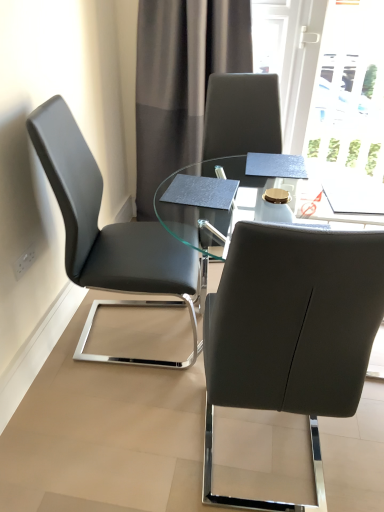
In order to face matte black chair at center, the first chair when ordered from right to left, should I rotate leftwards or rightwards?

Turn right approximately 11.751 degrees to face it.

This screenshot has width=384, height=512. What do you see at coordinates (224, 199) in the screenshot? I see `transparent glass table at center` at bounding box center [224, 199].

Identify the location of gray fabric curtain at upper center. The height and width of the screenshot is (512, 384). (181, 80).

From the picture: From a real-world perspective, is matte black chair at left, which appears as the 1th chair when viewed from the left, positioned above or below gray fabric curtain at upper center?

matte black chair at left, which appears as the 1th chair when viewed from the left, is situated lower than gray fabric curtain at upper center in the real world.

Looking at this image, considering the positions of objects matte black chair at left, arranged as the 2th chair when viewed from the right, and gray fabric curtain at upper center in the image provided, who is in front, matte black chair at left, arranged as the 2th chair when viewed from the right, or gray fabric curtain at upper center?

matte black chair at left, arranged as the 2th chair when viewed from the right, is closer to the camera.

In terms of width, does matte black chair at left, arranged as the 2th chair when viewed from the right, look wider or thinner when compared to gray fabric curtain at upper center?

In the image, matte black chair at left, arranged as the 2th chair when viewed from the right, appears to be wider than gray fabric curtain at upper center.

Could you measure the distance between matte black chair at left, which appears as the 1th chair when viewed from the left, and gray fabric curtain at upper center?

matte black chair at left, which appears as the 1th chair when viewed from the left, is 34.33 inches away from gray fabric curtain at upper center.

Is point (214, 393) behind point (56, 196)?

No, it is in front of (56, 196).

Can you confirm if matte black chair at center, the second chair when ordered from left to right, is smaller than matte black chair at left, arranged as the 2th chair when viewed from the right?

Yes, matte black chair at center, the second chair when ordered from left to right, is smaller than matte black chair at left, arranged as the 2th chair when viewed from the right.

From a real-world perspective, is matte black chair at center, the first chair when ordered from right to left, on top of matte black chair at left, which appears as the 1th chair when viewed from the left?

Indeed, from a real-world perspective, matte black chair at center, the first chair when ordered from right to left, stands above matte black chair at left, which appears as the 1th chair when viewed from the left.

Based on the photo, would you say matte black chair at left, arranged as the 2th chair when viewed from the right, is part of matte black chair at center, the first chair when ordered from right to left,'s contents?

No, matte black chair at left, arranged as the 2th chair when viewed from the right, is not a part of matte black chair at center, the first chair when ordered from right to left.

Is matte black chair at center, the second chair when ordered from left to right, located outside gray fabric curtain at upper center?

Indeed, matte black chair at center, the second chair when ordered from left to right, is completely outside gray fabric curtain at upper center.

Based on the photo, considering the positions of objects matte black chair at center, the second chair when ordered from left to right, and gray fabric curtain at upper center in the image provided, who is in front, matte black chair at center, the second chair when ordered from left to right, or gray fabric curtain at upper center?

matte black chair at center, the second chair when ordered from left to right, is in front.

Considering the positions of points (243, 281) and (143, 144), is point (243, 281) farther from camera compared to point (143, 144)?

No, (243, 281) is closer to viewer.

Is transparent glass table at center a part of matte black chair at left, which appears as the 1th chair when viewed from the left?

No, transparent glass table at center is not a part of matte black chair at left, which appears as the 1th chair when viewed from the left.

Between point (137, 257) and point (187, 196), which one is positioned in front?

The point (187, 196) is more forward.

Is matte black chair at left, arranged as the 2th chair when viewed from the right, bigger than transparent glass table at center?

No, matte black chair at left, arranged as the 2th chair when viewed from the right, is not bigger than transparent glass table at center.

Which of these two, matte black chair at left, which appears as the 1th chair when viewed from the left, or transparent glass table at center, is thinner?

matte black chair at left, which appears as the 1th chair when viewed from the left, is thinner.

Considering the positions of objects transparent glass table at center and gray fabric curtain at upper center in the image provided, who is in front, transparent glass table at center or gray fabric curtain at upper center?

transparent glass table at center is closer to the camera.

From the picture: From a real-world perspective, between transparent glass table at center and gray fabric curtain at upper center, who is vertically higher?

From a 3D spatial view, gray fabric curtain at upper center is above.

Is transparent glass table at center taller or shorter than gray fabric curtain at upper center?

Clearly, transparent glass table at center is shorter compared to gray fabric curtain at upper center.

Is transparent glass table at center aimed at gray fabric curtain at upper center?

No, transparent glass table at center is not oriented towards gray fabric curtain at upper center.

Could you tell me if transparent glass table at center is turned towards matte black chair at left, arranged as the 2th chair when viewed from the right?

No, transparent glass table at center does not turn towards matte black chair at left, arranged as the 2th chair when viewed from the right.

From the image's perspective, which is above, transparent glass table at center or matte black chair at left, which appears as the 1th chair when viewed from the left?

From the image's view, matte black chair at left, which appears as the 1th chair when viewed from the left, is above.

Based on their positions, is transparent glass table at center located to the left or right of matte black chair at left, arranged as the 2th chair when viewed from the right?

Based on their positions, transparent glass table at center is located to the right of matte black chair at left, arranged as the 2th chair when viewed from the right.

Looking at this image, between matte black chair at left, which appears as the 1th chair when viewed from the left, and matte black chair at center, the second chair when ordered from left to right, which one has larger size?

matte black chair at left, which appears as the 1th chair when viewed from the left, is bigger.

Is matte black chair at left, which appears as the 1th chair when viewed from the left, far away from matte black chair at center, the second chair when ordered from left to right?

matte black chair at left, which appears as the 1th chair when viewed from the left, is actually quite close to matte black chair at center, the second chair when ordered from left to right.

Does matte black chair at left, arranged as the 2th chair when viewed from the right, appear on the left side of matte black chair at center, the first chair when ordered from right to left?

Yes, matte black chair at left, arranged as the 2th chair when viewed from the right, is to the left of matte black chair at center, the first chair when ordered from right to left.

Between matte black chair at left, arranged as the 2th chair when viewed from the right, and matte black chair at center, the first chair when ordered from right to left, which one has less height?

matte black chair at left, arranged as the 2th chair when viewed from the right.

Locate an element on the screen. curtain behind the matte black chair at left, arranged as the 2th chair when viewed from the right is located at coordinates click(x=181, y=80).

Where is `chair on the left side of matte black chair at center, the second chair when ordered from left to right`? The height and width of the screenshot is (512, 384). chair on the left side of matte black chair at center, the second chair when ordered from left to right is located at coordinates (108, 233).

Considering their positions, is matte black chair at left, which appears as the 1th chair when viewed from the left, positioned further to gray fabric curtain at upper center than transparent glass table at center?

Based on the image, matte black chair at left, which appears as the 1th chair when viewed from the left, appears to be further to gray fabric curtain at upper center.

Looking at the image, which one is located further to matte black chair at left, which appears as the 1th chair when viewed from the left, transparent glass table at center or gray fabric curtain at upper center?

gray fabric curtain at upper center.

When comparing their distances from matte black chair at left, which appears as the 1th chair when viewed from the left, does matte black chair at center, the first chair when ordered from right to left, or gray fabric curtain at upper center seem closer?

matte black chair at center, the first chair when ordered from right to left, lies closer to matte black chair at left, which appears as the 1th chair when viewed from the left, than the other object.

Which object lies further to the anchor point transparent glass table at center, matte black chair at left, arranged as the 2th chair when viewed from the right, or gray fabric curtain at upper center?

The object further to transparent glass table at center is gray fabric curtain at upper center.

From the picture: Considering their positions, is gray fabric curtain at upper center positioned closer to matte black chair at center, the first chair when ordered from right to left, than transparent glass table at center?

transparent glass table at center.

Considering their positions, is matte black chair at center, the first chair when ordered from right to left, positioned further to gray fabric curtain at upper center than matte black chair at left, which appears as the 1th chair when viewed from the left?

matte black chair at center, the first chair when ordered from right to left, is positioned further to the anchor gray fabric curtain at upper center.

Considering their positions, is matte black chair at left, arranged as the 2th chair when viewed from the right, positioned closer to gray fabric curtain at upper center than matte black chair at center, the second chair when ordered from left to right?

Based on the image, matte black chair at left, arranged as the 2th chair when viewed from the right, appears to be nearer to gray fabric curtain at upper center.

Which object lies nearer to the anchor point matte black chair at left, arranged as the 2th chair when viewed from the right, transparent glass table at center or matte black chair at center, the second chair when ordered from left to right?

transparent glass table at center is positioned closer to the anchor matte black chair at left, arranged as the 2th chair when viewed from the right.

In order to click on chair between matte black chair at center, the second chair when ordered from left to right, and gray fabric curtain at upper center, along the z-axis in this screenshot , I will do `click(108, 233)`.

In order to click on table positioned between matte black chair at center, the first chair when ordered from right to left, and gray fabric curtain at upper center from near to far in this screenshot , I will do `click(224, 199)`.

At what (x,y) coordinates should I click in order to perform the action: click on chair between gray fabric curtain at upper center and transparent glass table at center from top to bottom. Please return your answer as a coordinate pair (x, y). Looking at the image, I should click on (108, 233).

Locate an element on the screen. The image size is (384, 512). chair between matte black chair at left, which appears as the 1th chair when viewed from the left, and transparent glass table at center, in the horizontal direction is located at coordinates (291, 331).